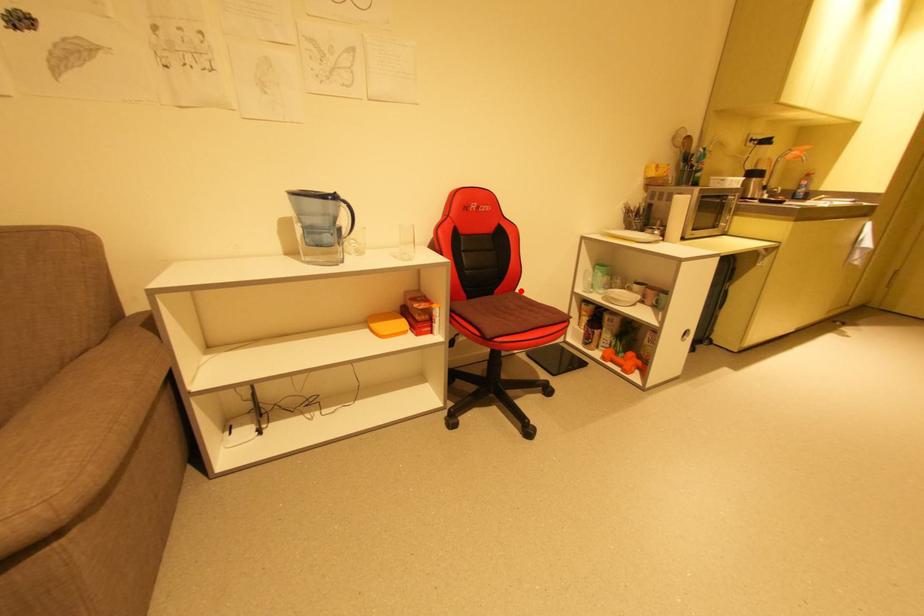
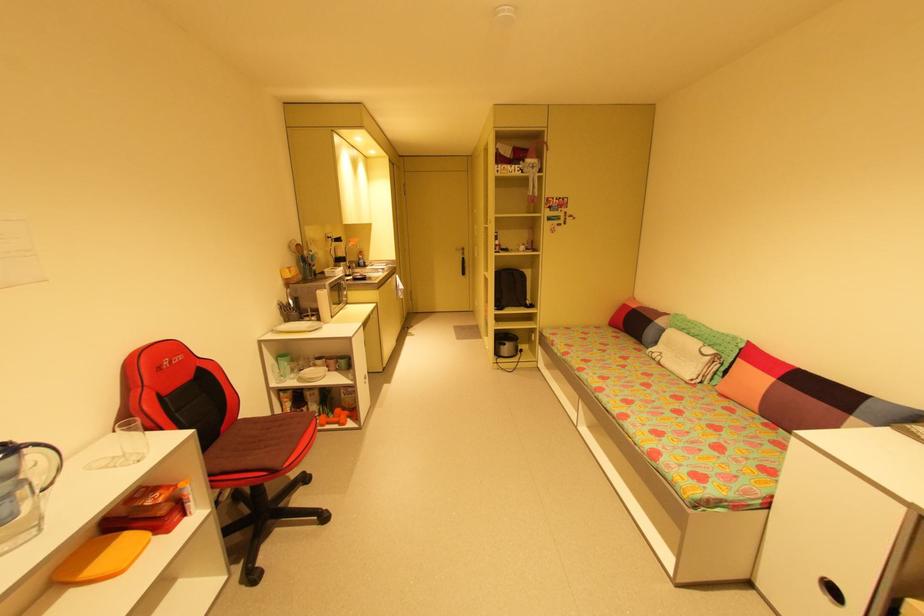
Question: A red point is marked in image1. In image2, is the corresponding 3D point closer to the camera or farther? Reply with the corresponding letter.

Choices:
 (A) The corresponding 3D point is closer.
 (B) The corresponding 3D point is farther.

Answer: (A)